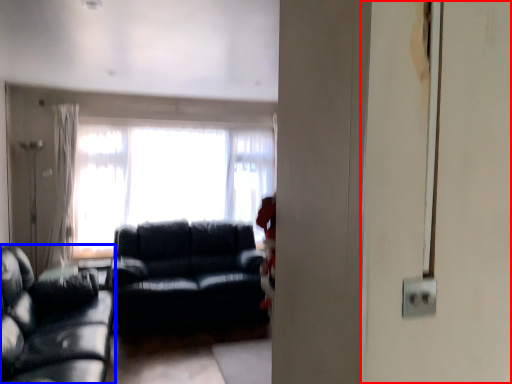
Question: Which object appears closest to the camera in this image, screen door (highlighted by a red box) or studio couch (highlighted by a blue box)?

Choices:
 (A) screen door
 (B) studio couch

Answer: (B)